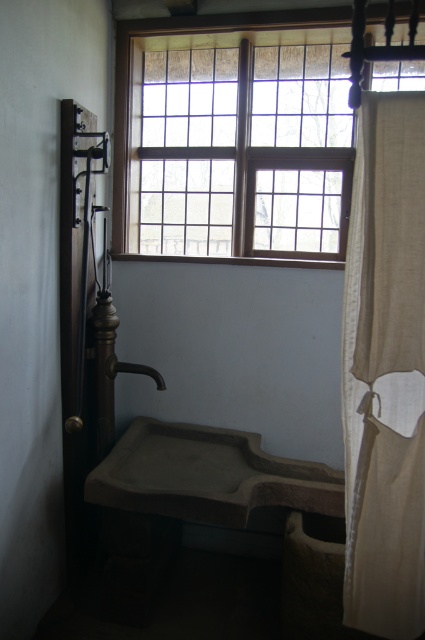
Based on the photo, you are a plumber trying to fix a leaky pipe under the sink. You need to reach the pipe located between the matte stone sink at lower left and the matte brown faucet at lower center. How much space do you have to work in inches?

The space between the matte stone sink at lower left and the matte brown faucet at lower center is 18.09 inches, so you have 18.09 inches of space to work with.

You are designing a layout for a rustic bathroom and need to place the wooden frame at upper center and the beige fabric curtain at right. Considering their sizes, which object should be placed closer to the entrance to ensure they are both visible from the doorway?

The wooden frame at upper center should be placed closer to the entrance because it has a larger size compared to the beige fabric curtain at right, ensuring both are visible from the doorway.